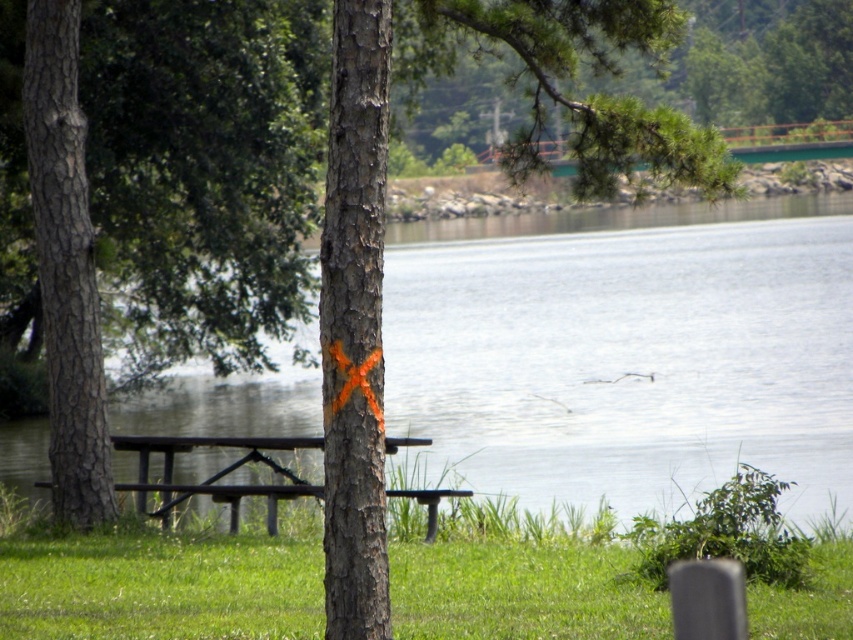
Question: Can you confirm if brown rough tree trunk at left is positioned to the right of wooden bench at center?

Choices:
 (A) no
 (B) yes

Answer: (A)

Question: Which object appears closest to the camera in this image?

Choices:
 (A) brown rough tree trunk at left
 (B) green grass at center
 (C) transparent water at center

Answer: (C)

Question: Which of the following is the farthest from the observer?

Choices:
 (A) (131, 378)
 (B) (234, 502)

Answer: (A)

Question: Based on their relative distances, which object is farther from the brown rough tree trunk at left?

Choices:
 (A) brown wooden picnic table at center
 (B) wooden bench at center
 (C) green grass at center

Answer: (C)

Question: Is brown rough tree trunk at left above green grass at center?

Choices:
 (A) no
 (B) yes

Answer: (B)

Question: Can you confirm if brown wooden picnic table at center is positioned below wooden bench at center?

Choices:
 (A) yes
 (B) no

Answer: (B)